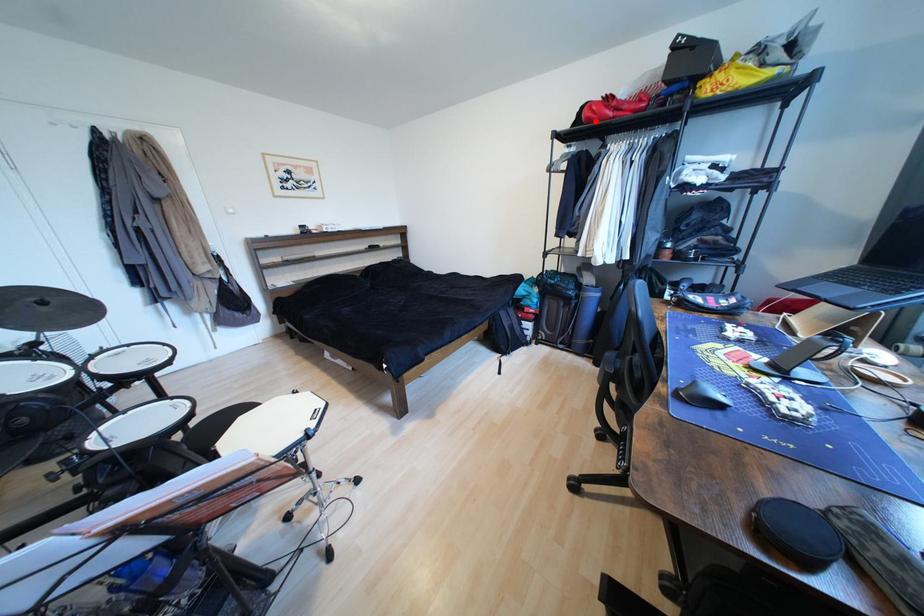
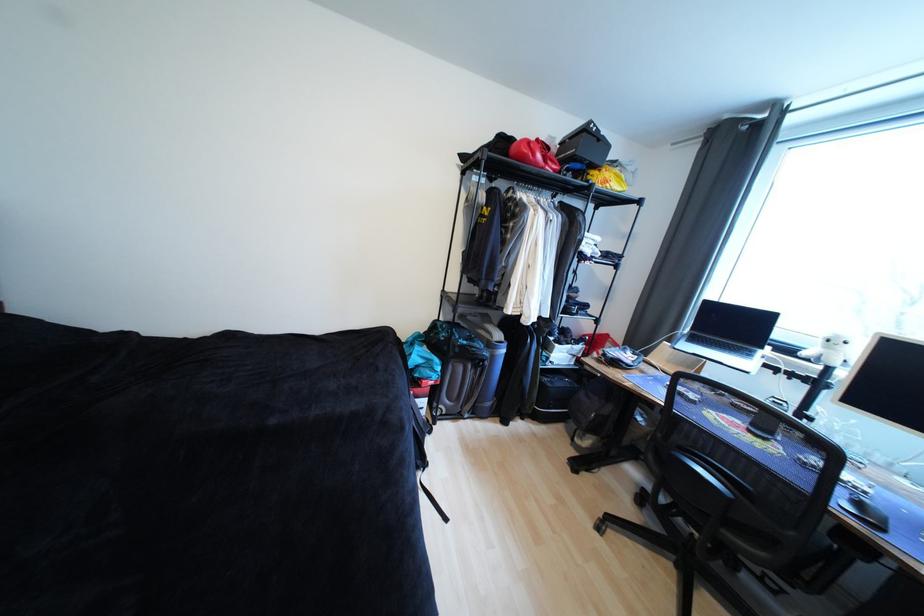
In the second image, find the point that corresponds to the highlighted location in the first image.

(529, 159)